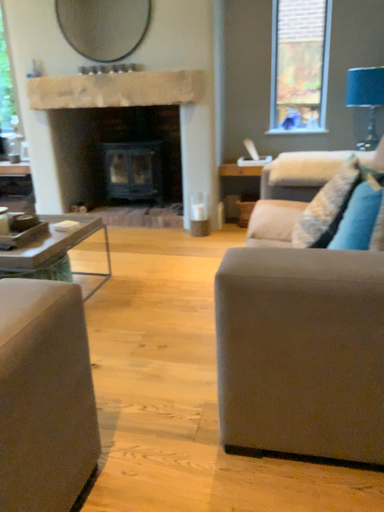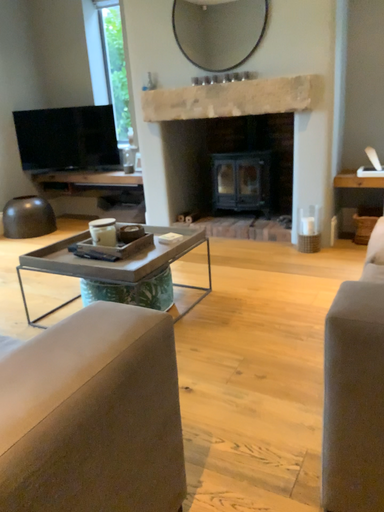
Question: Which way did the camera rotate in the video?

Choices:
 (A) rotated right
 (B) rotated left

Answer: (B)